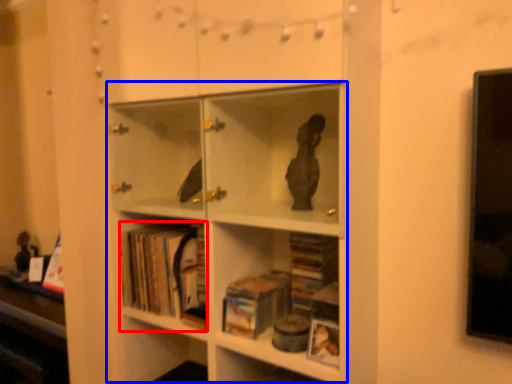
Question: Which point is further to the camera, book (highlighted by a red box) or bookcase (highlighted by a blue box)?

Choices:
 (A) book
 (B) bookcase

Answer: (A)